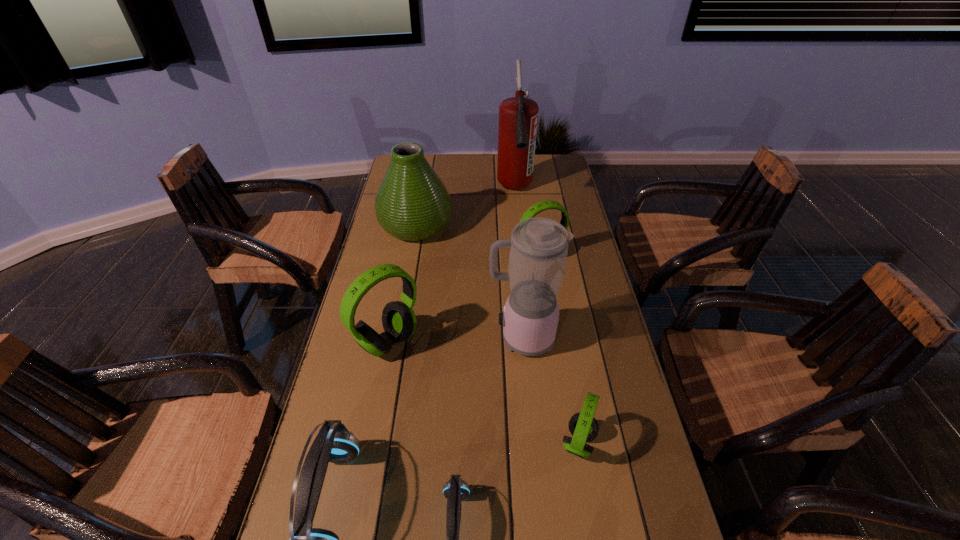
Select which green headset appears as the third closest to the red fire extinguisher. Please provide its 2D coordinates. Your answer should be formatted as a tuple, i.e. [(x, y)], where the tuple contains the x and y coordinates of a point satisfying the conditions above.

[(583, 426)]

The image size is (960, 540). I want to click on blue headset that stands as the closest to the tallest object, so click(334, 443).

Choose which blue headset is the second nearest neighbor to the second smallest green headset. Please provide its 2D coordinates. Your answer should be formatted as a tuple, i.e. [(x, y)], where the tuple contains the x and y coordinates of a point satisfying the conditions above.

[(456, 489)]

Find the location of a particular element. This screenshot has width=960, height=540. vacant region that satisfies the following two spatial constraints: 1. at the nozzle of the fire extinguisher; 2. on the base of the food processor near the control knob is located at coordinates (531, 338).

Where is `free space that satisfies the following two spatial constraints: 1. at the nozzle of the tallest object; 2. on the right side of the smallest green headset`? This screenshot has height=540, width=960. free space that satisfies the following two spatial constraints: 1. at the nozzle of the tallest object; 2. on the right side of the smallest green headset is located at coordinates (541, 443).

The image size is (960, 540). I want to click on blank area in the image that satisfies the following two spatial constraints: 1. at the nozzle of the second shortest headset; 2. on the left side of the fire extinguisher, so click(x=541, y=443).